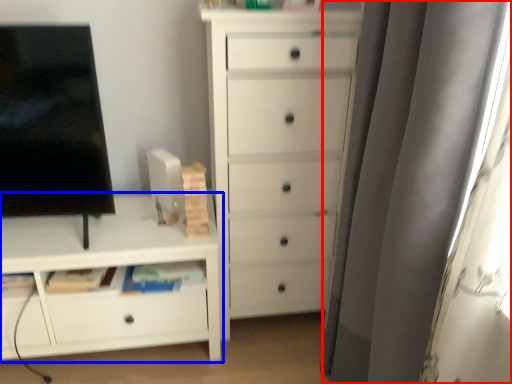
Question: Which object is further to the camera taking this photo, curtain (highlighted by a red box) or chest of drawers (highlighted by a blue box)?

Choices:
 (A) curtain
 (B) chest of drawers

Answer: (B)